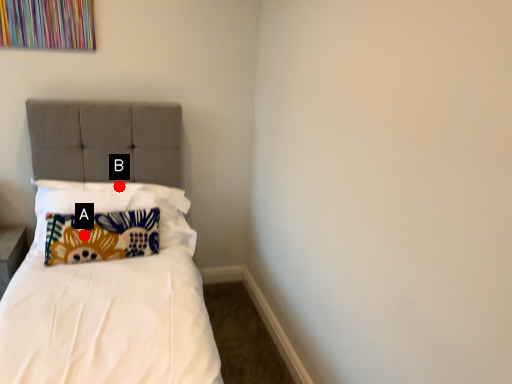
Question: Two points are circled on the image, labeled by A and B beside each circle. Which of the following is the farthest from the observer?

Choices:
 (A) A is further
 (B) B is further

Answer: (B)